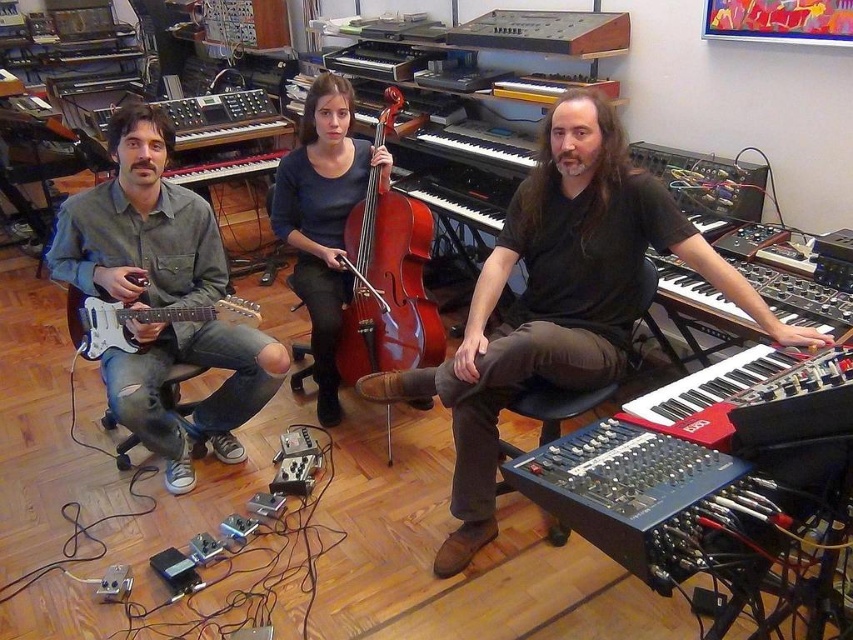
You are a sound engineer in a music studio. You need to move a microphone stand that is 60 centimeters wide. Can you place it between the matte black guitar at left and the brown matte cello at center without moving the instruments?

The distance between the matte black guitar at left and the brown matte cello at center is 56.21 centimeters. Since the microphone stand is 60 centimeters wide, it cannot fit in the space between them.

You are a photographer setting up a shoot in the music studio. You need to decide which item to place closer to the camera to ensure it fills the frame better. Between the matte dark blue sweater at center and the brown matte cello at center, which should you choose?

The matte dark blue sweater at center is larger in size than the brown matte cello at center, so placing it closer to the camera will help it fill the frame better.